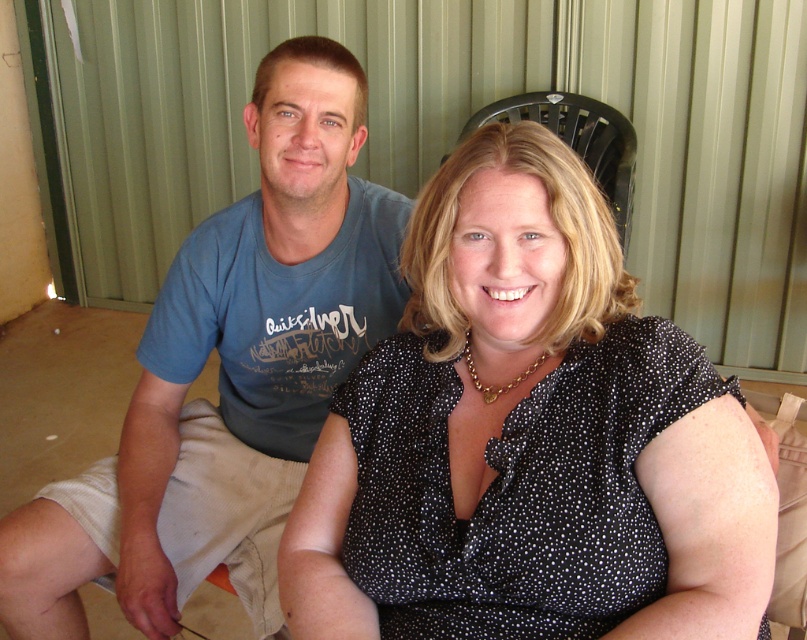
Question: Is the position of black dotted blouse at center more distant than that of blue cotton t-shirt at left?

Choices:
 (A) yes
 (B) no

Answer: (B)

Question: Which point is closer to the camera?

Choices:
 (A) blue cotton t-shirt at left
 (B) black plastic chair at upper center

Answer: (A)

Question: Which point is closer to the camera?

Choices:
 (A) black dotted blouse at center
 (B) blue cotton t-shirt at left

Answer: (A)

Question: Does blue cotton t-shirt at left appear under black plastic chair at upper center?

Choices:
 (A) yes
 (B) no

Answer: (A)

Question: Among these objects, which one is nearest to the camera?

Choices:
 (A) black plastic chair at upper center
 (B) black dotted blouse at center

Answer: (B)

Question: From the image, what is the correct spatial relationship of black dotted blouse at center in relation to black plastic chair at upper center?

Choices:
 (A) left
 (B) right

Answer: (A)